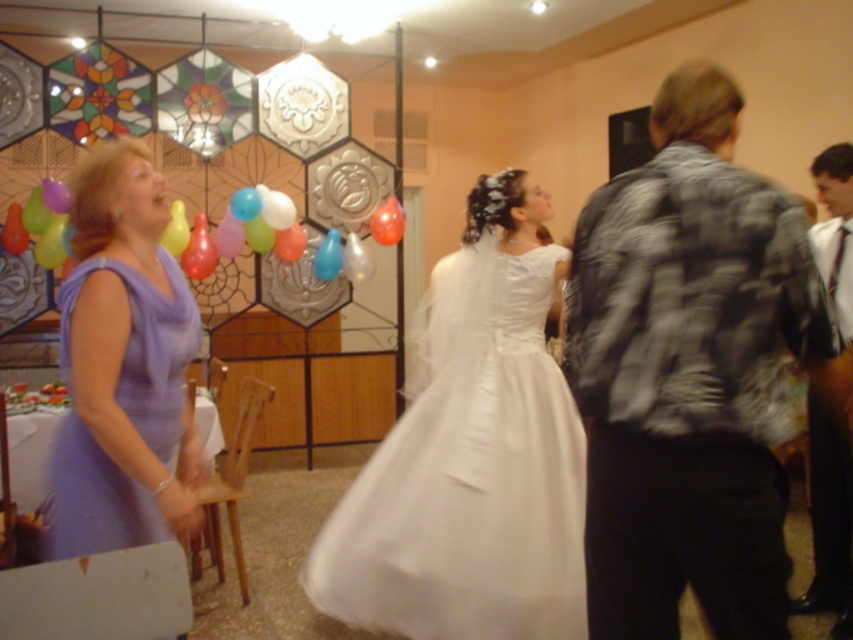
Measure the distance between point (x=146, y=438) and camera.

The distance of point (x=146, y=438) from camera is 1.70 meters.

Between lavender satin dress at left and translucent plastic balloon at upper center, which one is positioned lower?

lavender satin dress at left

The height and width of the screenshot is (640, 853). I want to click on lavender satin dress at left, so click(x=144, y=348).

The width and height of the screenshot is (853, 640). What are the coordinates of `lavender satin dress at left` in the screenshot? It's located at (144, 348).

Which is behind, point (550, 276) or point (840, 269)?

Point (840, 269)

This screenshot has width=853, height=640. Describe the element at coordinates (469, 476) in the screenshot. I see `satin white dress at center` at that location.

I want to click on satin white dress at center, so click(x=469, y=476).

Between plaid fabric jacket at right and shiny black jacket at right, which one has less height?

Standing shorter between the two is shiny black jacket at right.

Which is behind, point (619, 304) or point (813, 528)?

Point (813, 528)

This screenshot has height=640, width=853. I want to click on plaid fabric jacket at right, so 691,372.